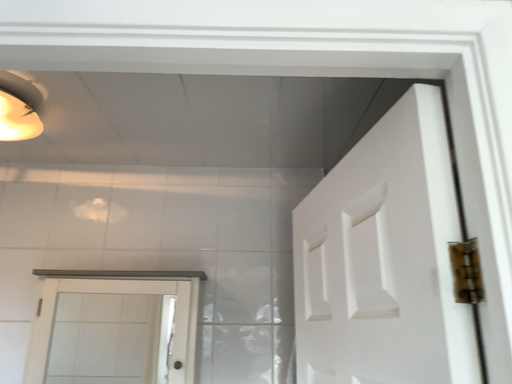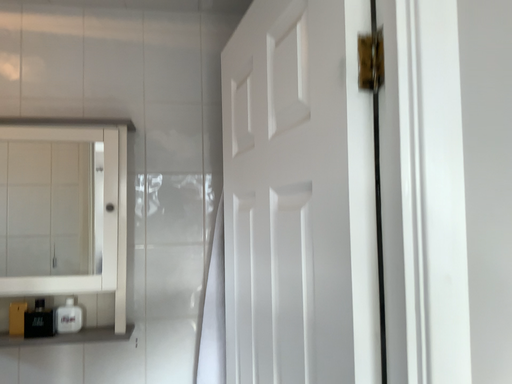
Question: How did the camera likely rotate when shooting the video?

Choices:
 (A) rotated left
 (B) rotated right

Answer: (B)